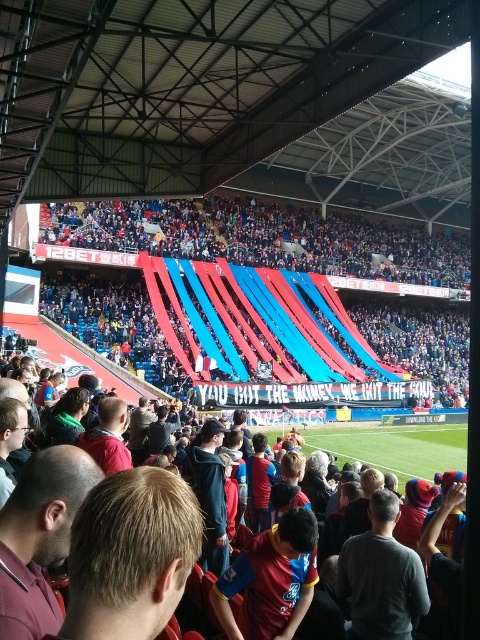
You are a photographer standing at the edge of the field during the game. You want to take a photo that includes both the blue fabric banner at upper center and the red jersey at center. Which object should you adjust your camera focus to first to ensure both are in the frame?

The blue fabric banner at upper center is closer to you than the red jersey at center, so focus on the blue fabric banner at upper center first to ensure both are in focus.

Based on the scene description and the objects provided, what is located at the coordinates point (267,237)?

The blue fabric banner at upper center is located at point (267,237).

You are a photographer standing in the stadium and want to take a photo of the red jersey at center and the blue fabric banner at upper center. Which object should you adjust your camera to focus on first if you want to capture both in the same frame without moving your position?

The blue fabric banner at upper center is positioned on the right side of the red jersey at center, so you should focus on the red jersey at center first as it is closer to the center of the frame, allowing the banner to be captured on its right side without needing to reposition.